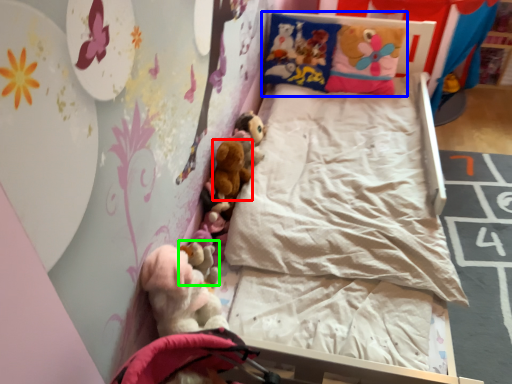
Question: Which object is positioned closest to toy (highlighted by a red box)? Select from pillow (highlighted by a blue box) and toy (highlighted by a green box).

Choices:
 (A) pillow
 (B) toy

Answer: (B)